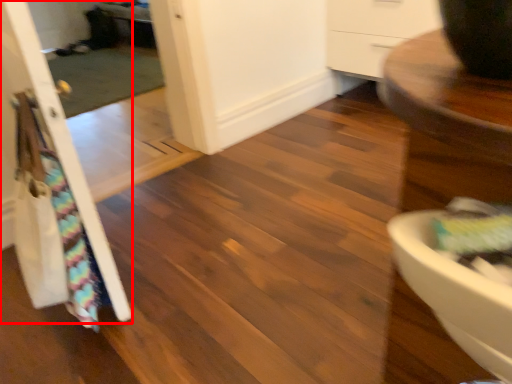
Question: Considering the relative positions of door (annotated by the red box) and screen door in the image provided, where is door (annotated by the red box) located with respect to the staircase?

Choices:
 (A) right
 (B) left

Answer: (B)